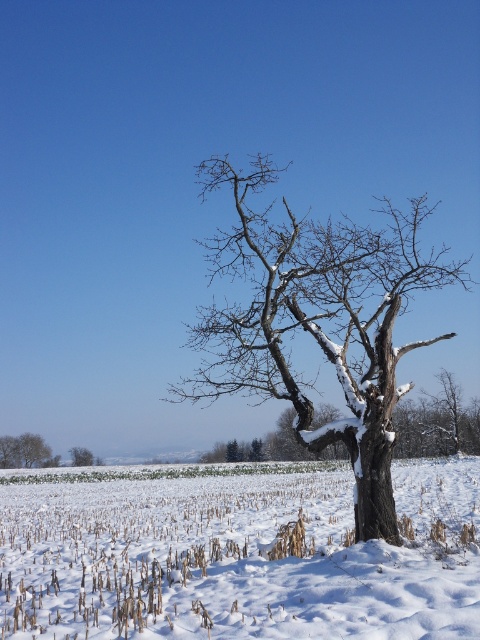
Does point (36, 452) come closer to viewer compared to point (88, 464)?

That is True.

Find the location of a particular element. The width and height of the screenshot is (480, 640). snow-covered tree at lower left is located at coordinates (24, 451).

Does white snow-covered corn field at center lie behind snow-covered wood at center?

No, it is in front of snow-covered wood at center.

What do you see at coordinates (237, 554) in the screenshot? I see `white snow-covered corn field at center` at bounding box center [237, 554].

Which is in front, point (416, 557) or point (451, 262)?

Point (416, 557) is more forward.

The height and width of the screenshot is (640, 480). What are the coordinates of `white snow-covered corn field at center` in the screenshot? It's located at click(x=237, y=554).

Does snow-covered wood at center appear under snow-covered tree at lower left?

No.

This screenshot has height=640, width=480. I want to click on snow-covered wood at center, so click(316, 321).